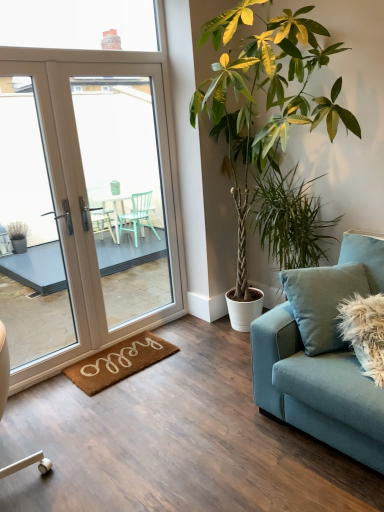
Question: Could you tell me if teal fabric couch at right is turned towards green leafy plant at center, the first houseplant viewed from the left?

Choices:
 (A) no
 (B) yes

Answer: (A)

Question: Can you confirm if teal fabric couch at right is shorter than green leafy plant at center, which appears as the second houseplant when viewed from the right?

Choices:
 (A) yes
 (B) no

Answer: (A)

Question: Is teal fabric couch at right further to camera compared to green leafy plant at center, which appears as the second houseplant when viewed from the right?

Choices:
 (A) yes
 (B) no

Answer: (B)

Question: Is teal fabric couch at right taller than green leafy plant at center, which appears as the second houseplant when viewed from the right?

Choices:
 (A) no
 (B) yes

Answer: (A)

Question: Does teal fabric couch at right have a lesser width compared to green leafy plant at center, which appears as the second houseplant when viewed from the right?

Choices:
 (A) yes
 (B) no

Answer: (B)

Question: Considering their positions, is teal fabric couch at right located in front of or behind white glossy door at left?

Choices:
 (A) front
 (B) behind

Answer: (A)

Question: Considering the relative positions of teal fabric couch at right and white glossy door at left in the image provided, is teal fabric couch at right to the left or to the right of white glossy door at left?

Choices:
 (A) left
 (B) right

Answer: (B)

Question: Considering the positions of point (357, 454) and point (92, 148), is point (357, 454) closer or farther from the camera than point (92, 148)?

Choices:
 (A) closer
 (B) farther

Answer: (A)

Question: From the image's perspective, is teal fabric couch at right above or below white glossy door at left?

Choices:
 (A) above
 (B) below

Answer: (B)

Question: Is white glossy door at left in front of or behind transparent glass window at upper center in the image?

Choices:
 (A) front
 (B) behind

Answer: (A)

Question: Is white glossy door at left inside or outside of transparent glass window at upper center?

Choices:
 (A) outside
 (B) inside

Answer: (A)

Question: From a real-world perspective, relative to transparent glass window at upper center, is white glossy door at left vertically above or below?

Choices:
 (A) below
 (B) above

Answer: (A)

Question: Is point (39, 335) closer or farther from the camera than point (67, 34)?

Choices:
 (A) closer
 (B) farther

Answer: (B)

Question: Visually, is green leafy plant at center, the 2th houseplant when ordered from left to right, positioned to the left or to the right of transparent glass window at upper center?

Choices:
 (A) right
 (B) left

Answer: (A)

Question: From the image's perspective, is green leafy plant at center, the first houseplant in the right-to-left sequence, located above or below transparent glass window at upper center?

Choices:
 (A) below
 (B) above

Answer: (A)